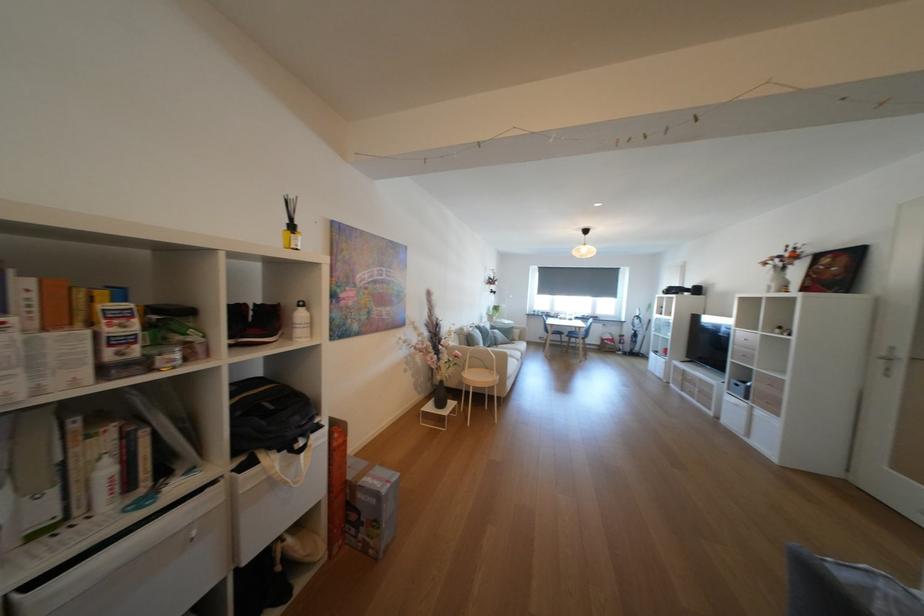
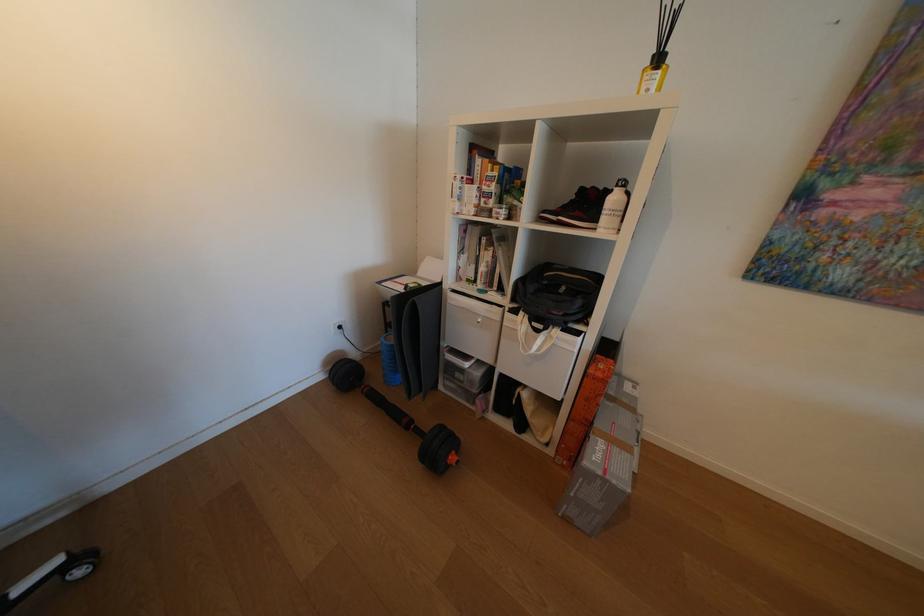
Where in the second image is the point corresponding to the point at 299,223 from the first image?

(665, 54)